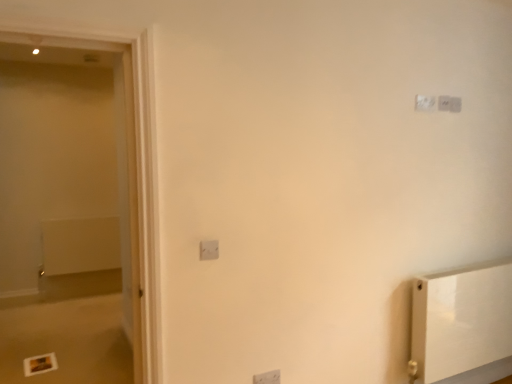
Question: Is white plastic light switch at center, positioned as the second light switch in front-to-back order, outside of white matte radiator at left?

Choices:
 (A) yes
 (B) no

Answer: (A)

Question: From a real-world perspective, is white plastic light switch at center, positioned as the second light switch in front-to-back order, located beneath white matte radiator at left?

Choices:
 (A) yes
 (B) no

Answer: (A)

Question: Is the position of white plastic light switch at center, which is the third light switch in right-to-left order, more distant than that of white matte radiator at left?

Choices:
 (A) no
 (B) yes

Answer: (A)

Question: Is white plastic light switch at center, which is the third light switch in right-to-left order, to the right of white matte radiator at left from the viewer's perspective?

Choices:
 (A) yes
 (B) no

Answer: (A)

Question: Is white plastic light switch at center, placed as the first light switch when sorted from bottom to top, at the left side of white matte radiator at left?

Choices:
 (A) yes
 (B) no

Answer: (B)

Question: Considering their positions, is white plastic light switch at center, acting as the 3th light switch starting from the back, located in front of or behind white plastic light switch at upper right, marked as the 4th light switch in a front-to-back arrangement?

Choices:
 (A) front
 (B) behind

Answer: (A)

Question: Would you say white plastic light switch at center, the 4th light switch in the top-to-bottom sequence, is to the left or to the right of white plastic light switch at upper right, arranged as the 4th light switch when ordered from the bottom, in the picture?

Choices:
 (A) right
 (B) left

Answer: (B)

Question: Is white plastic light switch at center, placed as the first light switch when sorted from bottom to top, spatially inside white plastic light switch at upper right, arranged as the 4th light switch when ordered from the bottom, or outside of it?

Choices:
 (A) outside
 (B) inside

Answer: (A)

Question: Is point (278, 370) positioned closer to the camera than point (441, 104)?

Choices:
 (A) farther
 (B) closer

Answer: (B)

Question: In terms of height, does white plastic light switch at upper right, positioned as the third light switch in bottom-to-top order, look taller or shorter compared to white plastic light switch at upper right, the fourth light switch in the left-to-right sequence?

Choices:
 (A) tall
 (B) short

Answer: (A)

Question: In terms of width, does white plastic light switch at upper right, the third light switch viewed from the front, look wider or thinner when compared to white plastic light switch at upper right, which is the first light switch in top-to-bottom order?

Choices:
 (A) wide
 (B) thin

Answer: (A)

Question: In the image, is white plastic light switch at upper right, the second light switch positioned from the top, positioned in front of or behind white plastic light switch at upper right, arranged as the 4th light switch when ordered from the bottom?

Choices:
 (A) behind
 (B) front

Answer: (B)

Question: From a real-world perspective, is white plastic light switch at upper right, which is the third light switch from left to right, positioned above or below white plastic light switch at upper right, which is the first light switch in top-to-bottom order?

Choices:
 (A) above
 (B) below

Answer: (B)

Question: Considering the positions of white matte radiator at left and white plastic light switch at center, the 4th light switch viewed from the back, in the image, is white matte radiator at left bigger or smaller than white plastic light switch at center, the 4th light switch viewed from the back,?

Choices:
 (A) big
 (B) small

Answer: (A)

Question: Considering the positions of white matte radiator at left and white plastic light switch at center, marked as the first light switch in a left-to-right arrangement, in the image, is white matte radiator at left wider or thinner than white plastic light switch at center, marked as the first light switch in a left-to-right arrangement,?

Choices:
 (A) thin
 (B) wide

Answer: (B)